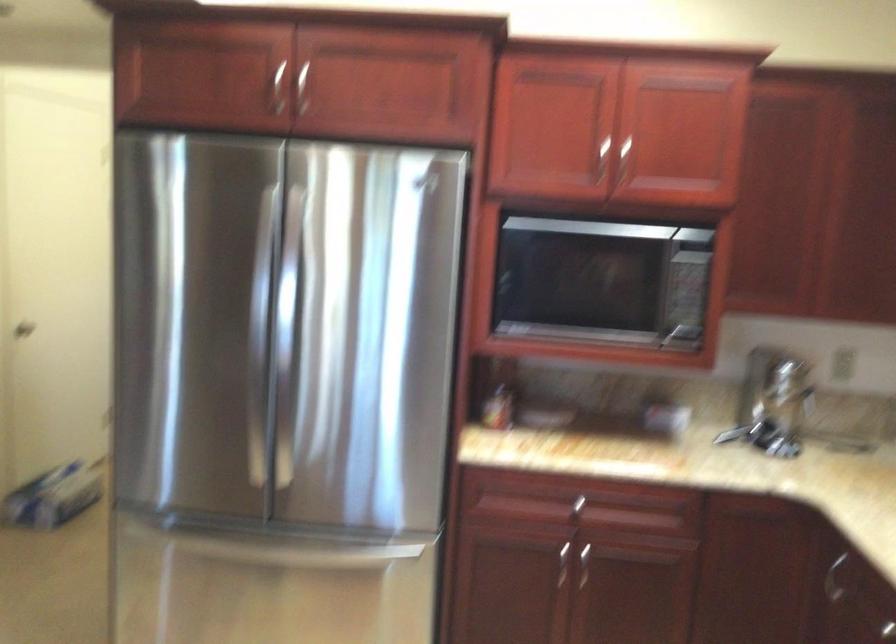
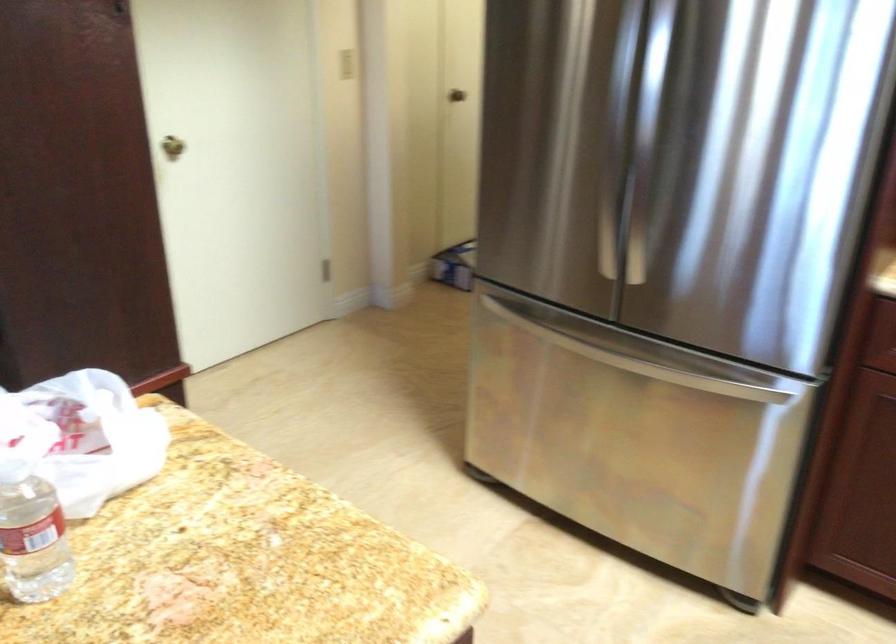
Question: The first image is from the beginning of the video and the second image is from the end. How did the camera likely rotate when shooting the video?

Choices:
 (A) Left
 (B) Right
 (C) Up
 (D) Down

Answer: (A)